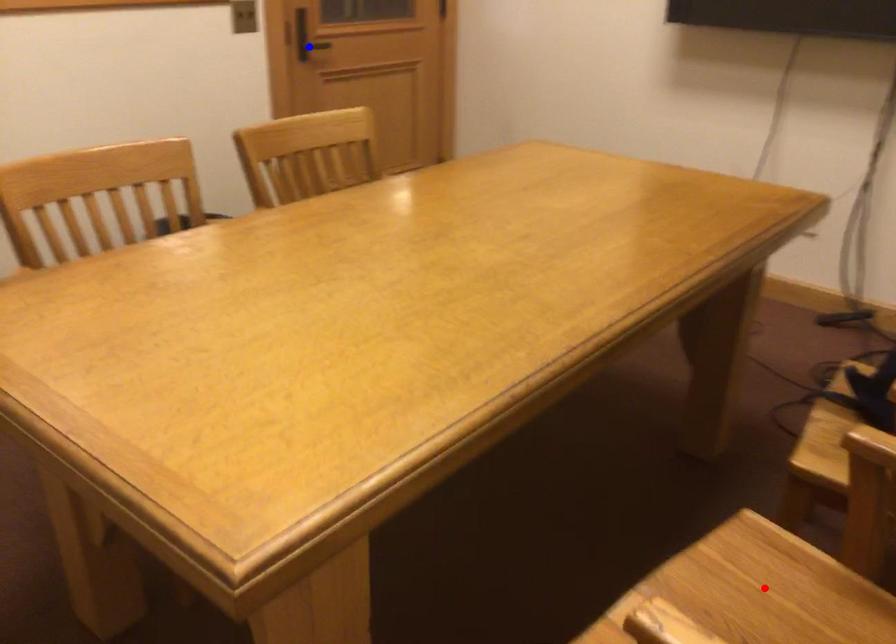
Question: Which of the two points in the image is closer to the camera?

Choices:
 (A) Blue point is closer.
 (B) Red point is closer.

Answer: (B)